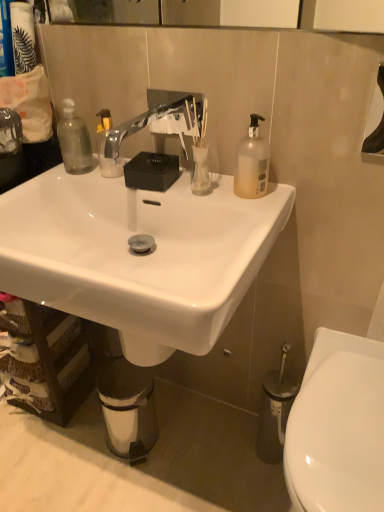
This screenshot has width=384, height=512. Find the location of `free space above metallic silver trash can at lower center (from a real-world perspective)`. free space above metallic silver trash can at lower center (from a real-world perspective) is located at coordinates click(118, 377).